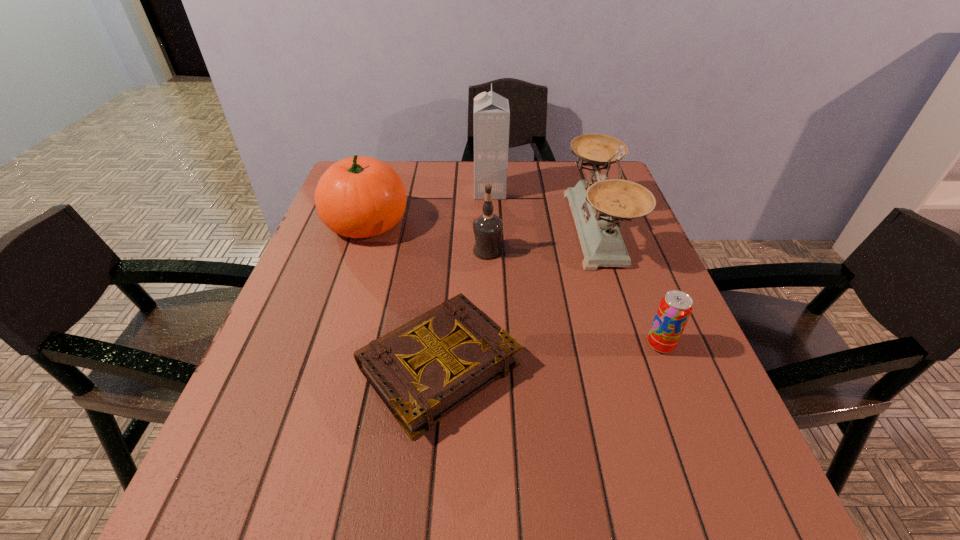
Locate an element on the screen. the tallest object is located at coordinates (491, 111).

Locate an element on the screen. This screenshot has width=960, height=540. scale is located at coordinates (598, 207).

The width and height of the screenshot is (960, 540). What are the coordinates of `pumpkin` in the screenshot? It's located at (358, 197).

The width and height of the screenshot is (960, 540). I want to click on vodka, so click(487, 228).

The width and height of the screenshot is (960, 540). I want to click on soda can, so click(675, 308).

You are a GUI agent. You are given a task and a screenshot of the screen. Output one action in this format:
    pyautogui.click(x=<x>, y=<y>)
    Task: Click on the shortest object
    
    Given the screenshot: What is the action you would take?
    pyautogui.click(x=423, y=370)

The height and width of the screenshot is (540, 960). I want to click on free location located on the front label of the carton, so click(372, 192).

In order to click on free space located 0.270m on the front label of the carton in this screenshot , I will do `click(382, 192)`.

Where is `free point located on the front label of the carton`? The width and height of the screenshot is (960, 540). free point located on the front label of the carton is located at coordinates (337, 192).

I want to click on vacant space located on the front-facing side of the scale, so click(522, 230).